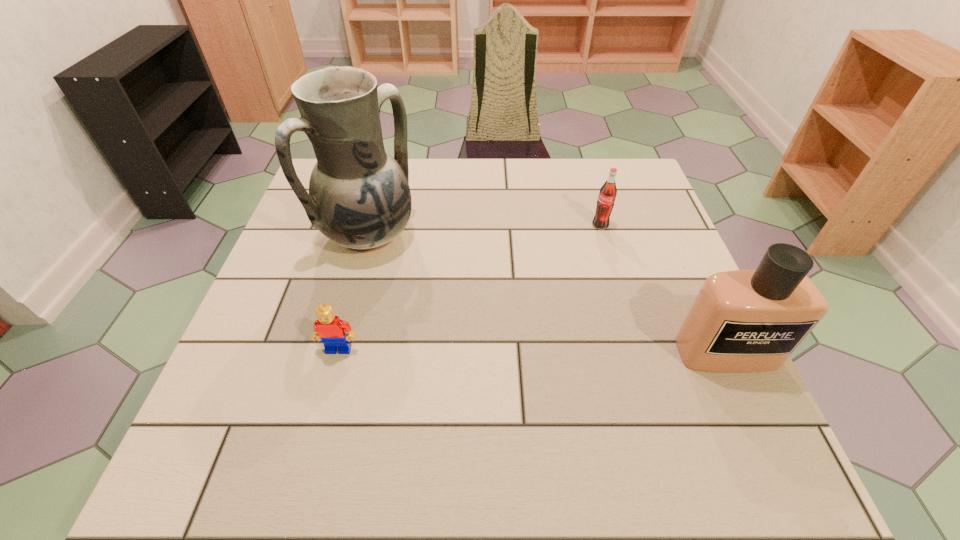
At what (x,y) coordinates should I click in order to perform the action: click on the shortest object. Please return your answer as a coordinate pair (x, y). The height and width of the screenshot is (540, 960). Looking at the image, I should click on (329, 328).

Find the location of a particular element. perfume is located at coordinates (743, 320).

The image size is (960, 540). I want to click on the rightmost object, so click(743, 320).

At what (x,y) coordinates should I click in order to perform the action: click on the second shortest object. Please return your answer as a coordinate pair (x, y). Looking at the image, I should click on (605, 203).

Where is `the third object from left to right`? The height and width of the screenshot is (540, 960). the third object from left to right is located at coordinates (605, 203).

Identify the location of pitcher. This screenshot has height=540, width=960. (359, 197).

Find the location of a particular element. The image size is (960, 540). free space located on the front-facing side of the shortest object is located at coordinates (322, 414).

Locate an element on the screen. Image resolution: width=960 pixels, height=540 pixels. free spot located on the front label of the rightmost object is located at coordinates (759, 424).

Identify the location of vacant space situated on the label of the third tallest object. The image size is (960, 540). (589, 261).

This screenshot has width=960, height=540. I want to click on blank space located 0.190m on the label of the third tallest object, so click(x=584, y=281).